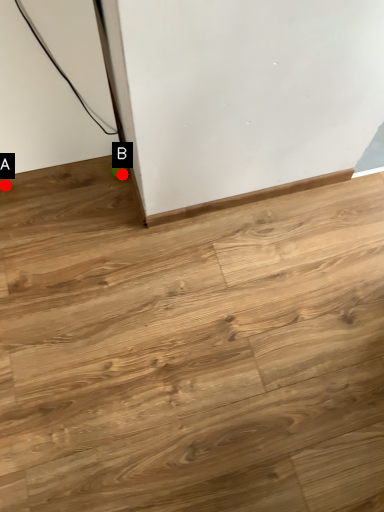
Question: Two points are circled on the image, labeled by A and B beside each circle. Which point is farther to the camera?

Choices:
 (A) A is further
 (B) B is further

Answer: (B)